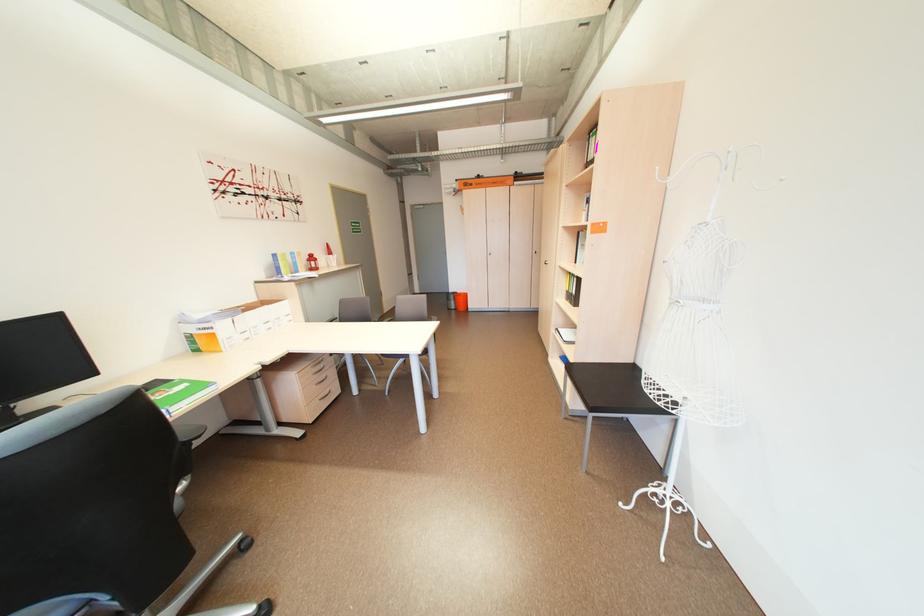
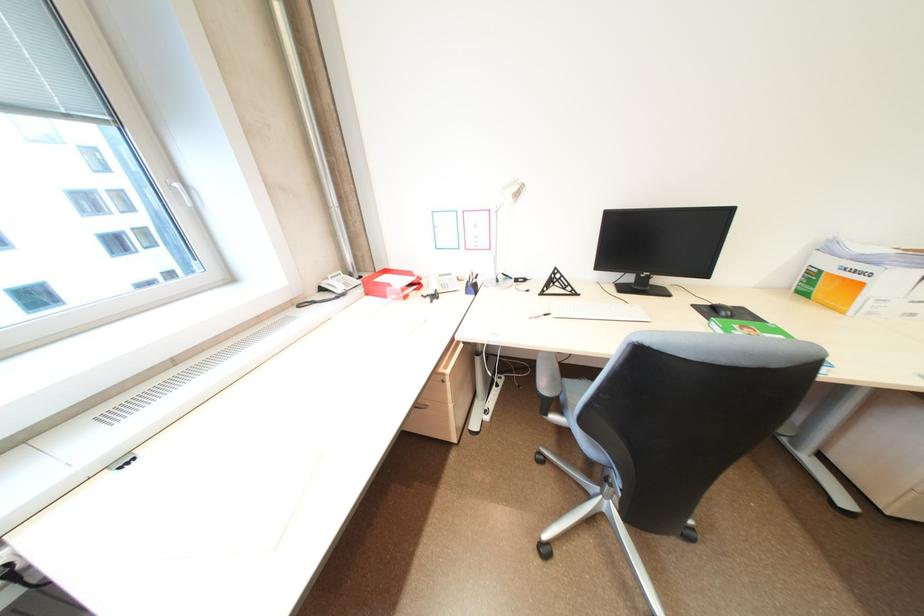
First-person continuous shooting, in which direction is the camera rotating?

The camera rotated toward left-down.